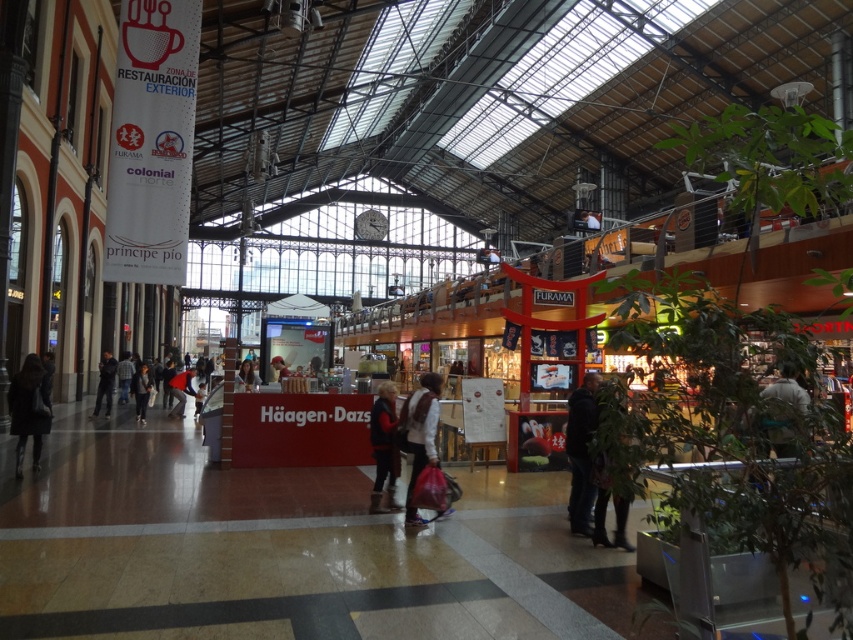
You are a customer looking for the restroom in the mall. You see a dark brown leather coat at lower left and dark blue jeans at left. Which direction should you go relative to these items to find the restroom?

The restroom is located to the right of the dark brown leather coat at lower left and dark blue jeans at left.

You are a delivery robot with a width of 1.5 meters. You need to navigate through the shopping mall and pass between the dark blue jeans at center and the white cotton jacket at center. Can you fit through the space between them?

The distance between the dark blue jeans at center and the white cotton jacket at center is 2.07 meters. Since your width is 1.5 meters, you can fit through the space as it is wider than your robot.